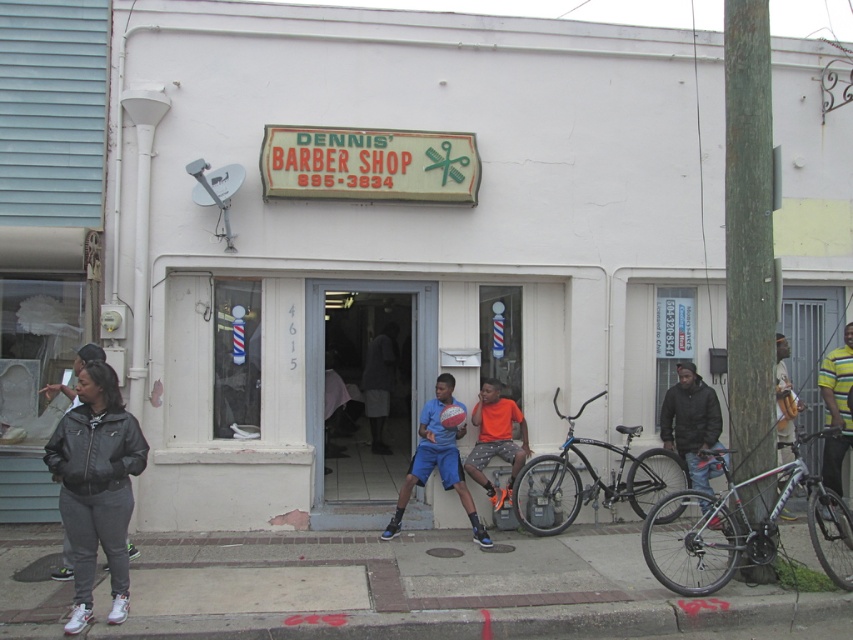
You are a customer entering Dennis Barber Shop and you see a dark brown leather jacket at right and a blue athletic shorts at center. Which item is smaller in size?

The dark brown leather jacket at right is smaller in size compared to the blue athletic shorts at center.

You are a customer entering Dennis Barber Shop and see a dark brown leather jacket at right and a blue athletic shorts at center. Which item is located more to the right side?

The dark brown leather jacket at right is positioned on the right side of blue athletic shorts at center, so the dark brown leather jacket at right is more to the right side.